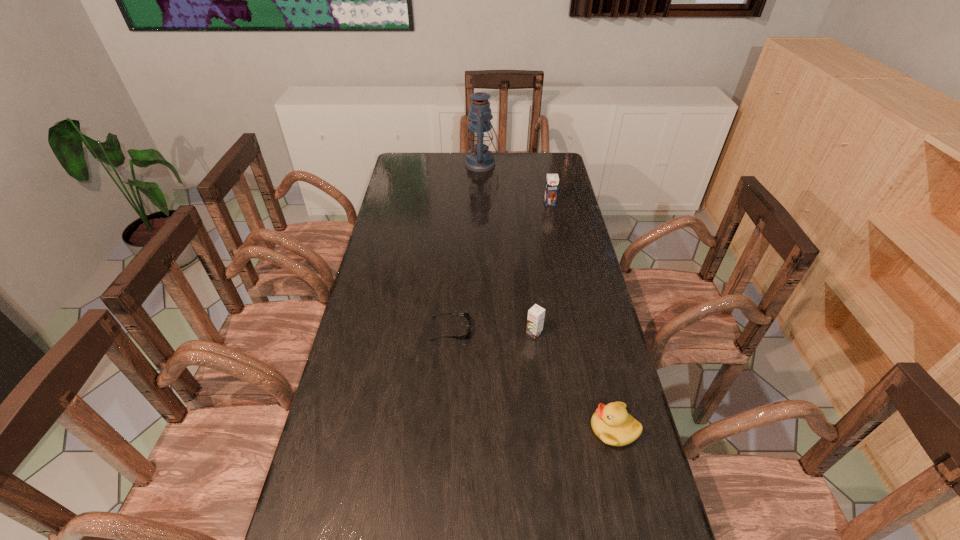
The width and height of the screenshot is (960, 540). Find the location of `vacant area that lies between the fourth nearest object and the nearest object`. vacant area that lies between the fourth nearest object and the nearest object is located at coordinates (582, 316).

Where is `vacant area that lies between the shortest object and the farthest object`? This screenshot has height=540, width=960. vacant area that lies between the shortest object and the farthest object is located at coordinates (467, 247).

This screenshot has width=960, height=540. Find the location of `vacant space that's between the second tallest object and the sunglasses`. vacant space that's between the second tallest object and the sunglasses is located at coordinates (500, 266).

Where is `free space that is in between the lantern and the shortest object`? free space that is in between the lantern and the shortest object is located at coordinates (467, 247).

You are a GUI agent. You are given a task and a screenshot of the screen. Output one action in this format:
    pyautogui.click(x=<x>, y=<y>)
    Task: Click on the unoccupied area between the farthest object and the third object from left to right
    This screenshot has height=540, width=960.
    Given the screenshot: What is the action you would take?
    pyautogui.click(x=508, y=248)

The width and height of the screenshot is (960, 540). I want to click on object that is the third closest to the right chocolate milk, so click(x=465, y=314).

The width and height of the screenshot is (960, 540). Identify the location of the third closest object to the farthest object. click(536, 314).

Locate an element on the screen. This screenshot has width=960, height=540. blank space that satisfies the following two spatial constraints: 1. on the front-facing side of the sunglasses; 2. on the back side of the nearer chocolate milk is located at coordinates (450, 333).

Where is `blank area in the image that satisfies the following two spatial constraints: 1. on the front label of the farther chocolate milk; 2. on the front-facing side of the sunglasses`? The width and height of the screenshot is (960, 540). blank area in the image that satisfies the following two spatial constraints: 1. on the front label of the farther chocolate milk; 2. on the front-facing side of the sunglasses is located at coordinates (576, 329).